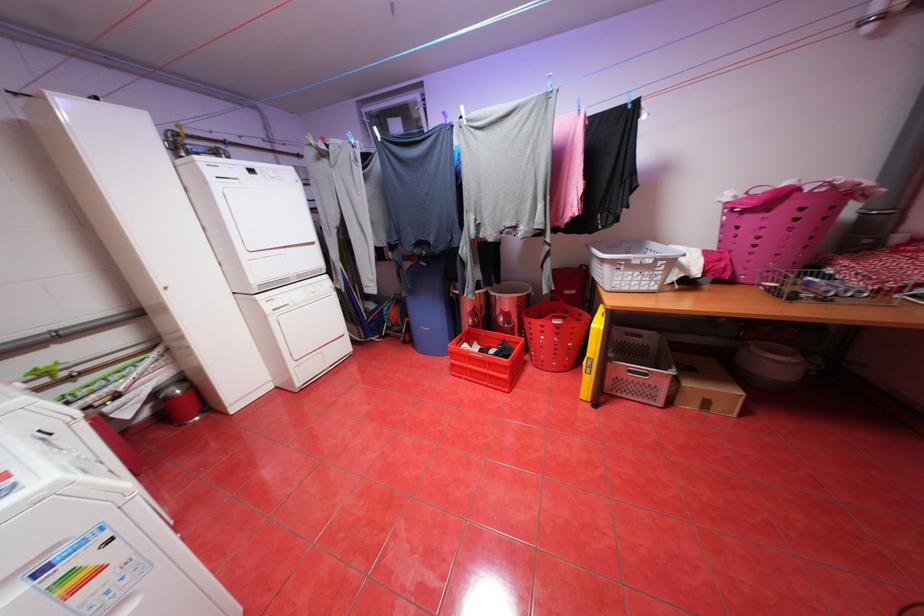
Identify the location of white basket handle. The width and height of the screenshot is (924, 616). (642, 257).